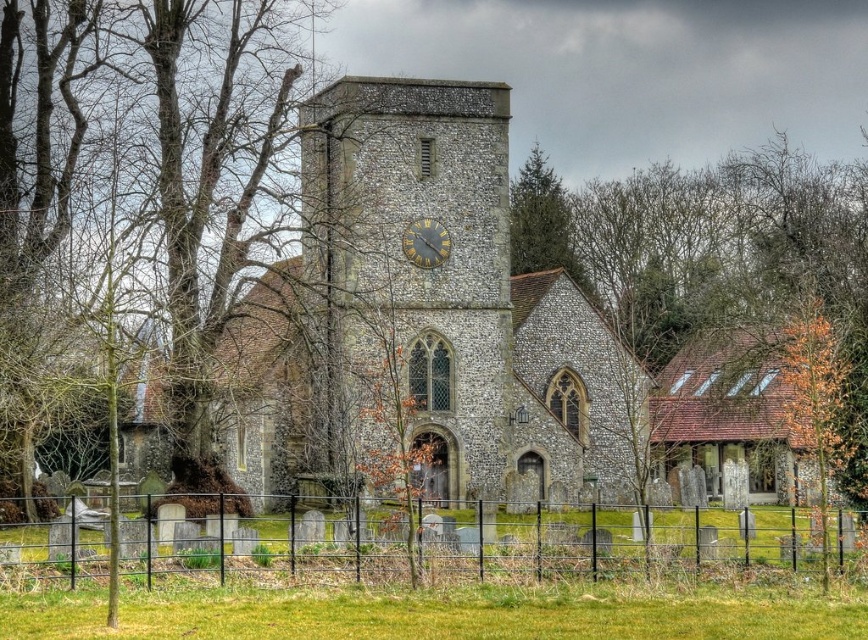
You are standing in the cemetery and want to take a photo of the stone clock tower at center without the black metal fence at lower center blocking the view. Based on the scene description, is this possible?

The stone clock tower at center is taller than the black metal fence at lower center, so you can take a photo of the stone clock tower at center without the black metal fence at lower center blocking the view by positioning yourself at a lower angle or moving further back to frame the tower above the fence.

You are standing at the entrance of the historic stone church and want to locate the stone clock tower at center. According to the coordinates provided, where should you look relative to your current position?

The stone clock tower at center is located at coordinates point (411, 266), which means it is directly in front of you at the center of the scene.

Consider the image. You are an architect visiting the historic site. You need to determine which object, the stone church at center or the dark brown wooden clock at center, would cast a longer shadow during midday. Based on the scene description, which one do you think it would be?

The stone church at center has a larger size compared to the dark brown wooden clock at center, so the stone church at center would cast a longer shadow during midday.